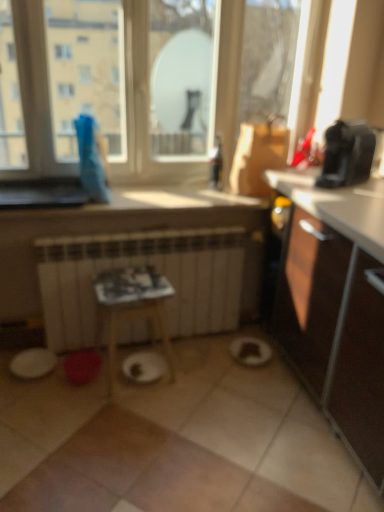
At what (x,y) coordinates should I click in order to perform the action: click on free point in front of white matte paper plate at center. Please return your answer as a coordinate pair (x, y). Looking at the image, I should click on (133, 402).